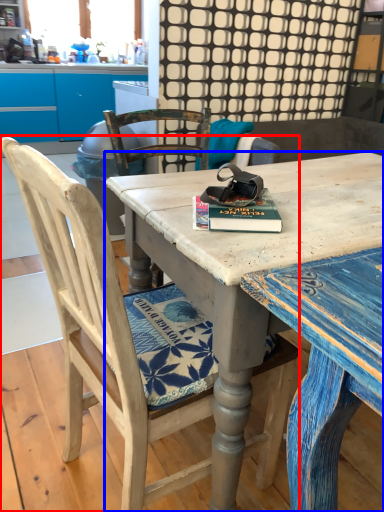
Question: Which point is further to the camera, chair (highlighted by a red box) or desk (highlighted by a blue box)?

Choices:
 (A) chair
 (B) desk

Answer: (B)